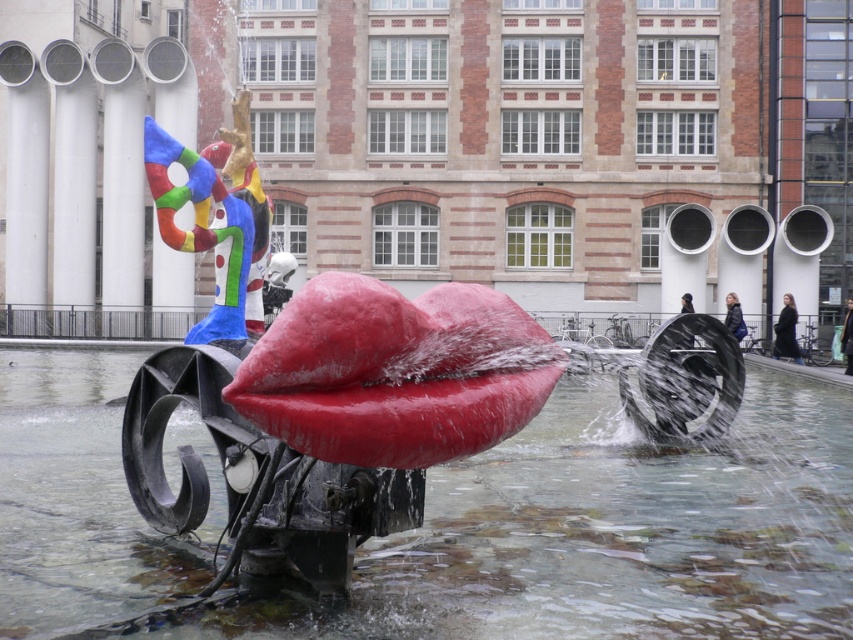
You are standing in the city square and see the dark gray coat at lower right and the dark hair person at center. Which object is positioned lower in the image?

The dark gray coat at lower right is positioned below the dark hair person at center, so it is lower in the image.

You are a photographer trying to capture a clear shot of both the dark gray coat at lower right and the dark hair person at center. Since you want both subjects to be fully visible in your frame, which one should you adjust your camera focus to prioritize based on their sizes?

The dark gray coat at lower right is thinner than the dark hair person at center, so you should prioritize focusing on the dark hair person at center to ensure both are visible without cropping either.